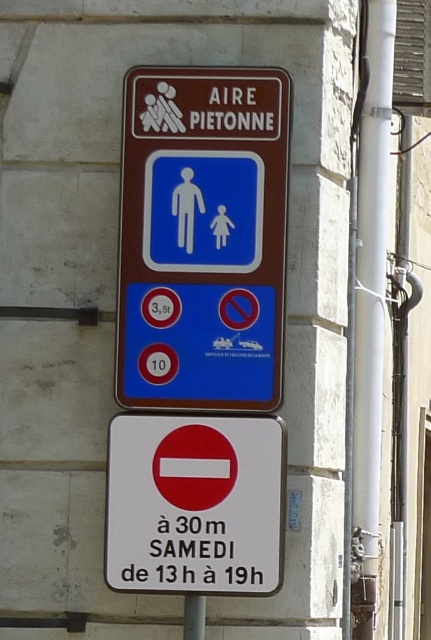
Question: Which of the following is the closest to the observer?

Choices:
 (A) white plastic pipe at right
 (B) matte plastic sign at center
 (C) white plastic sign at center

Answer: (C)

Question: Which point is closer to the camera?

Choices:
 (A) (367, 600)
 (B) (143, 417)

Answer: (B)

Question: Considering the relative positions of matte plastic sign at center and white plastic pipe at right in the image provided, where is matte plastic sign at center located with respect to white plastic pipe at right?

Choices:
 (A) above
 (B) below

Answer: (A)

Question: Is matte plastic sign at center to the right of white plastic pipe at right from the viewer's perspective?

Choices:
 (A) no
 (B) yes

Answer: (A)

Question: Considering the real-world distances, which object is farthest from the white plastic sign at center?

Choices:
 (A) white plastic pipe at right
 (B) matte plastic sign at center

Answer: (A)

Question: Does matte plastic sign at center appear under white plastic pipe at right?

Choices:
 (A) yes
 (B) no

Answer: (B)